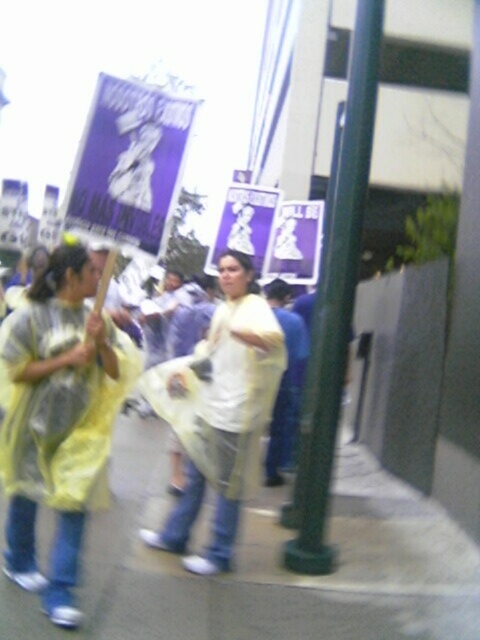
Who is taller, smooth concrete pavement at lower center or white matte shirt at center?

With more height is white matte shirt at center.

Consider the image. Can you confirm if smooth concrete pavement at lower center is bigger than white matte shirt at center?

Actually, smooth concrete pavement at lower center might be smaller than white matte shirt at center.

Does point (124, 572) come farther from viewer compared to point (207, 420)?

No.

Where is `smooth concrete pavement at lower center`? smooth concrete pavement at lower center is located at coordinates (265, 564).

Is point (414, 584) closer to camera compared to point (98, 458)?

No, it is behind (98, 458).

Can you confirm if smooth concrete pavement at lower center is positioned below yellow plastic poncho at left?

Indeed, smooth concrete pavement at lower center is positioned under yellow plastic poncho at left.

The image size is (480, 640). What are the coordinates of `smooth concrete pavement at lower center` in the screenshot? It's located at (265, 564).

You are a GUI agent. You are given a task and a screenshot of the screen. Output one action in this format:
    pyautogui.click(x=<x>, y=<y>)
    Task: Click on the smooth concrete pavement at lower center
    The height and width of the screenshot is (640, 480).
    Given the screenshot: What is the action you would take?
    pyautogui.click(x=265, y=564)

Does smooth concrete pavement at lower center have a greater width compared to white t-shirt at center?

Yes.

Who is more forward, (148, 576) or (276, 396)?

Point (148, 576)

Describe the element at coordinates (265, 564) in the screenshot. This screenshot has height=640, width=480. I see `smooth concrete pavement at lower center` at that location.

I want to click on smooth concrete pavement at lower center, so click(x=265, y=564).